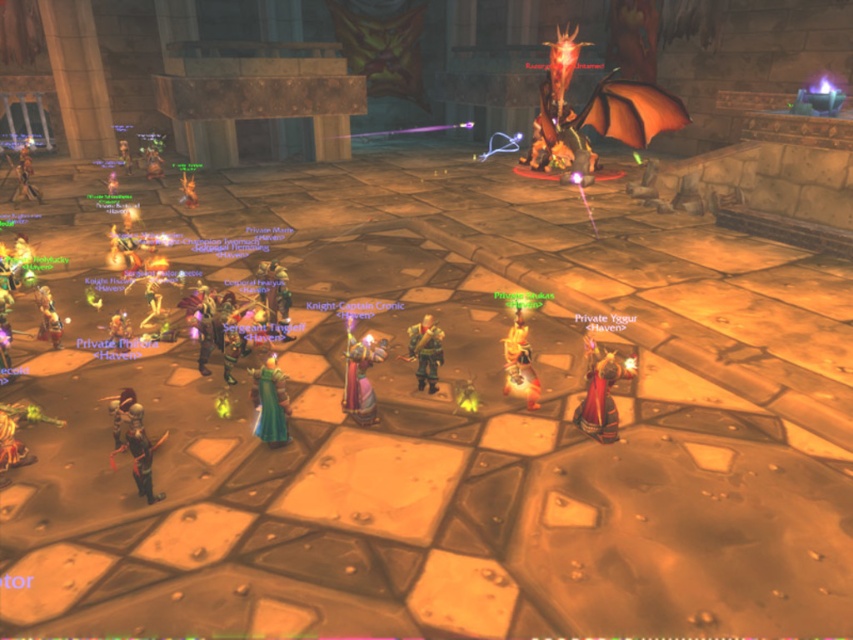
Between leather armor at lower left and shiny gold armor at left, which one is positioned higher?

shiny gold armor at left

Locate an element on the screen. Image resolution: width=853 pixels, height=640 pixels. leather armor at lower left is located at coordinates (138, 451).

Is point (260, 417) positioned behind point (125, 154)?

No.

Locate an element on the screen. The height and width of the screenshot is (640, 853). emerald velvet dress at center is located at coordinates (271, 403).

Where is `emerald velvet dress at center`? The width and height of the screenshot is (853, 640). emerald velvet dress at center is located at coordinates (271, 403).

Between emerald velvet dress at center and leather armor at lower left, which one appears on the right side from the viewer's perspective?

emerald velvet dress at center is more to the right.

Is point (265, 380) in front of point (146, 477)?

No, it is not.

Is point (276, 420) positioned before point (149, 472)?

No, (276, 420) is further to viewer.

The width and height of the screenshot is (853, 640). Find the location of `emerald velvet dress at center`. emerald velvet dress at center is located at coordinates click(x=271, y=403).